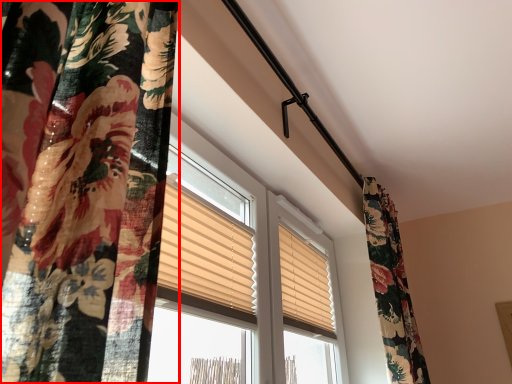
Question: From the image's perspective, where is curtain (annotated by the red box) located in relation to window blind in the image?

Choices:
 (A) above
 (B) below

Answer: (A)